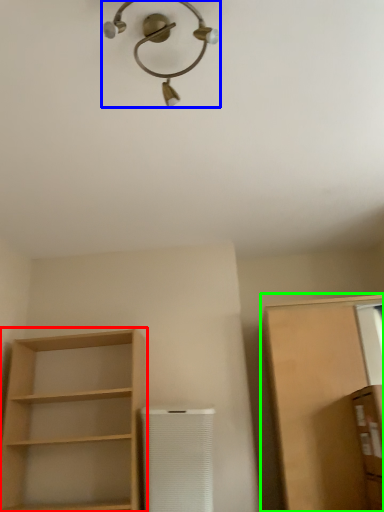
Question: Which object is positioned farthest from shelf (highlighted by a red box)? Select from light fixture (highlighted by a blue box) and cabinetry (highlighted by a green box).

Choices:
 (A) light fixture
 (B) cabinetry

Answer: (A)